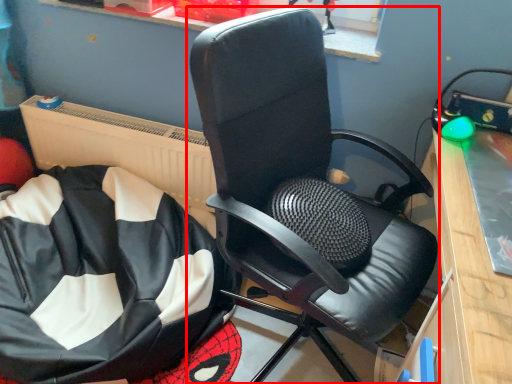
Question: From the image's perspective, what is the correct spatial relationship of chair (annotated by the red box) in relation to bean bag chair?

Choices:
 (A) below
 (B) above

Answer: (B)